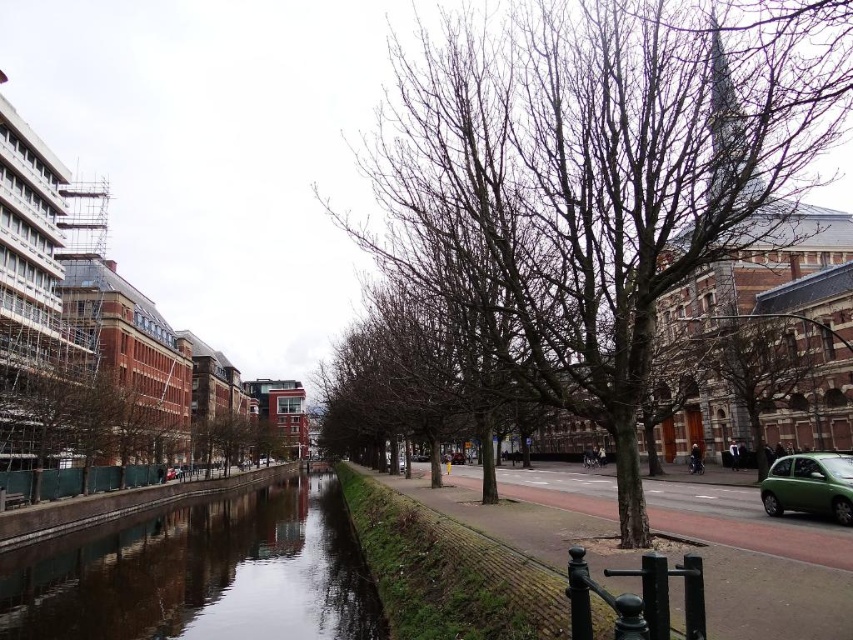
Question: Can you confirm if bare branches at center is positioned above smooth concrete canal at center?

Choices:
 (A) yes
 (B) no

Answer: (A)

Question: Which object is farther from the camera taking this photo?

Choices:
 (A) green leafy tree at left
 (B) bare branches at center
 (C) green matte car at lower right

Answer: (A)

Question: Which of the following is the farthest from the observer?

Choices:
 (A) green leafy tree at left
 (B) green matte car at lower right
 (C) bare wood tree at center
 (D) bare branches at center

Answer: (A)

Question: Can you confirm if green leafy tree at left is positioned to the left of bare wood tree at center?

Choices:
 (A) no
 (B) yes

Answer: (B)

Question: Which point is farther from the camera taking this photo?

Choices:
 (A) (585, 177)
 (B) (120, 573)
 (C) (804, 365)

Answer: (C)

Question: Does bare branches at center appear over green leafy tree at left?

Choices:
 (A) yes
 (B) no

Answer: (A)